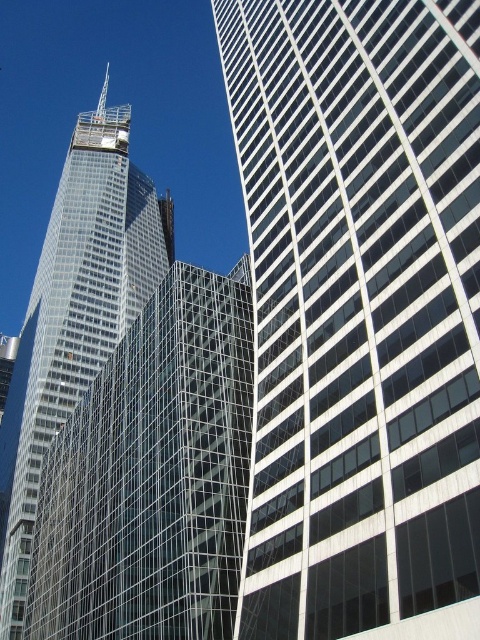
You are standing at the base of the tallest building on the left in the image. You want to reach a point located at coordinates point (x=433, y=97). If your walking speed is 3 feet per second, how many seconds will it take you to reach that point?

The distance between you and point (x=433, y=97) is 134.79 feet. At a walking speed of 3 feet per second, it will take approximately 44.93 seconds to reach the point.

You are standing at the base of the tallest building on the left and want to walk to the rectangular skyscraper on the right. There are two points marked on the path between them. Which point, point (176, 586) or point (72, 243), is closer to your starting position?

Point (176, 586) is closer to your starting position at the base of the tallest building on the left because it is in front of point (72, 243) along the path.

You are an architect planning to install a large advertisement banner between the transparent glass building at center and the clear glass skyscraper at left. Based on their positions, which building should the banner be attached to so that it faces the street in front of them?

The transparent glass building at center is positioned on the right side of the clear glass skyscraper at left, so the banner should be attached to the clear glass skyscraper at left to face the street in front of them.